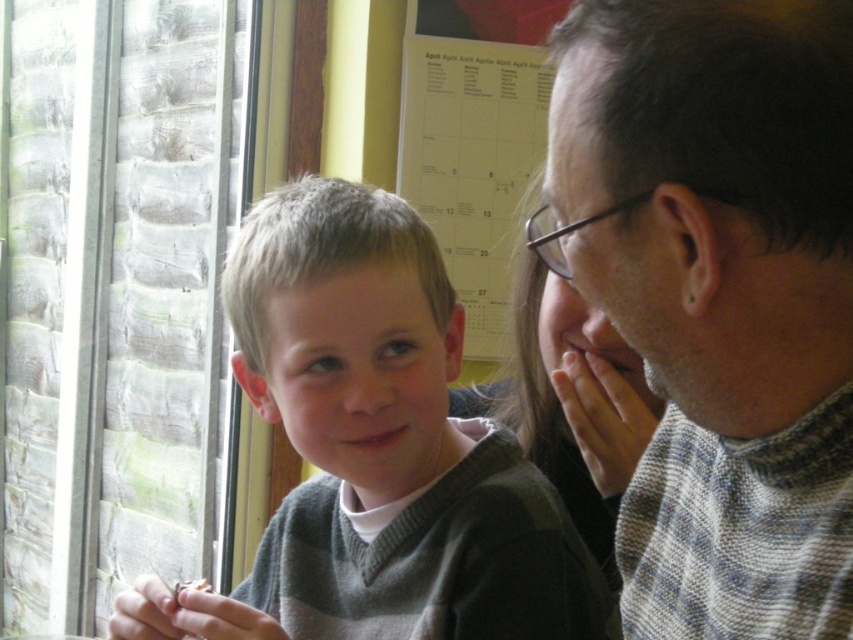
Question: In this image, where is gray knitted sweater at right located relative to white paper calendar at upper center?

Choices:
 (A) right
 (B) left

Answer: (A)

Question: Which point is closer to the camera?

Choices:
 (A) (445, 240)
 (B) (582, 74)

Answer: (B)

Question: Which object appears farthest from the camera in this image?

Choices:
 (A) gray knitted sweater at right
 (B) gray sweater at left
 (C) white paper calendar at upper center

Answer: (C)

Question: Where is gray sweater at left located in relation to white paper calendar at upper center in the image?

Choices:
 (A) above
 (B) below

Answer: (B)

Question: Does gray sweater at left have a larger size compared to white paper calendar at upper center?

Choices:
 (A) no
 (B) yes

Answer: (B)

Question: Which point appears closest to the camera in this image?

Choices:
 (A) (437, 104)
 (B) (399, 554)
 (C) (604, 52)

Answer: (C)